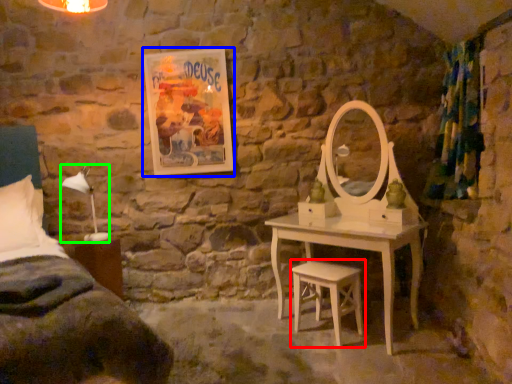
Question: Which object is the closest to the stool (highlighted by a red box)? Choose among these: picture frame (highlighted by a blue box) or table lamp (highlighted by a green box).

Choices:
 (A) picture frame
 (B) table lamp

Answer: (A)